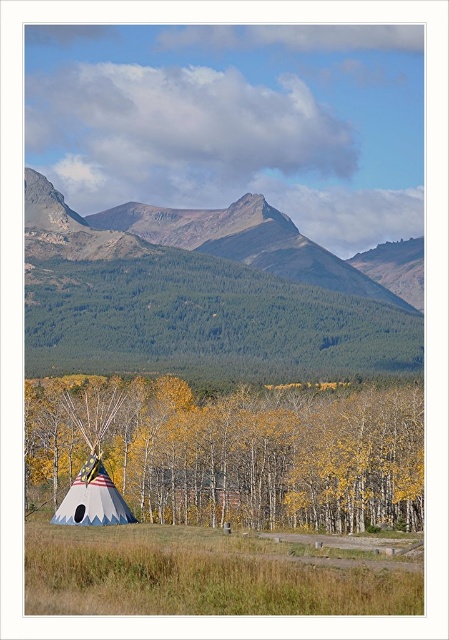
You are an explorer trying to determine the relative heights of the green forested mountain at upper center and the american flag fabric teepee at lower left. Based on the scene, which object is taller?

The green forested mountain at upper center is taller than the american flag fabric teepee at lower left according to the description.

You are planning to set up a tent in the area near the white fabric teepee at lower left and the american flag fabric teepee at lower left. Based on their sizes, which teepee would require more space to accommodate its width?

The white fabric teepee at lower left has a larger width than the american flag fabric teepee at lower left, so it would require more space to accommodate its width.